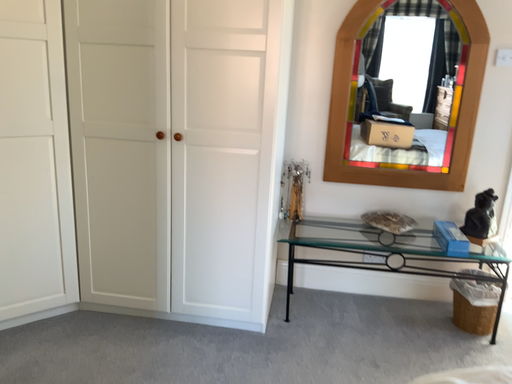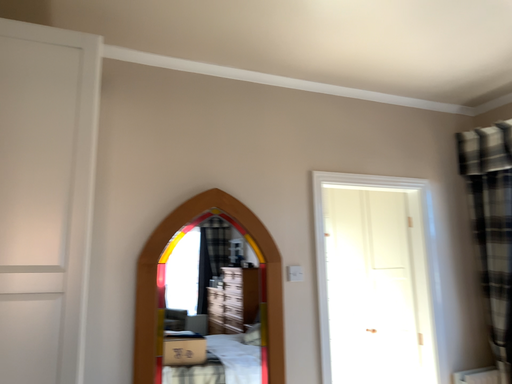
Question: Which way did the camera rotate in the video?

Choices:
 (A) rotated left
 (B) rotated right

Answer: (B)